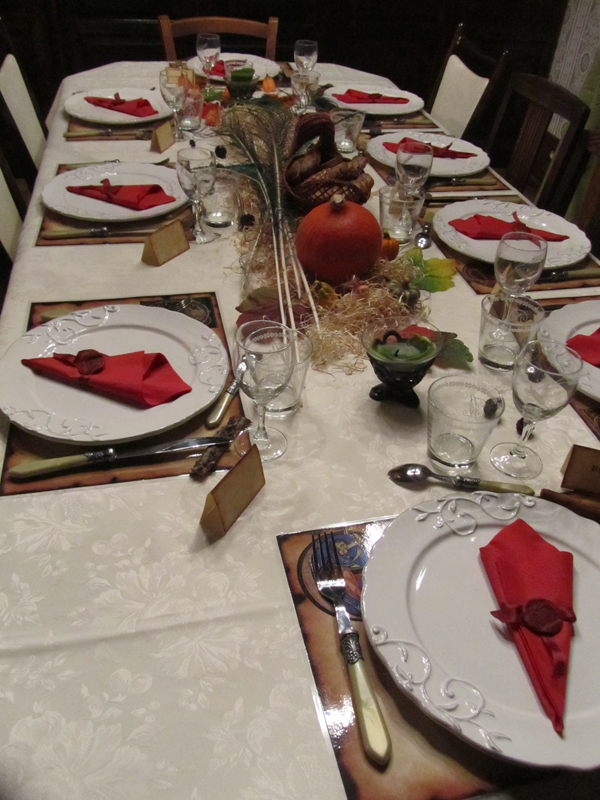
Find the location of a particular element. The height and width of the screenshot is (800, 600). wine glasses is located at coordinates (540, 392), (522, 266), (258, 374), (413, 169), (186, 169), (169, 86), (211, 48), (310, 56), (297, 84).